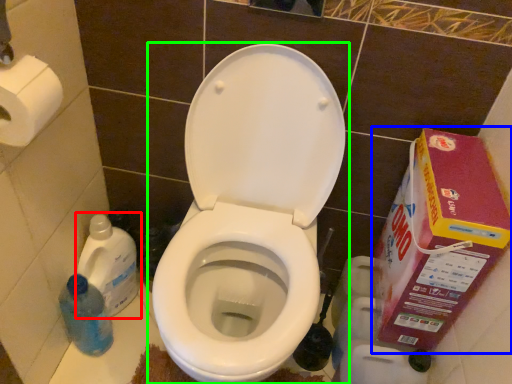
Question: Which object is positioned closest to cleaning product (highlighted by a red box)? Select from cardboard box (highlighted by a blue box) and toilet (highlighted by a green box).

Choices:
 (A) cardboard box
 (B) toilet

Answer: (B)